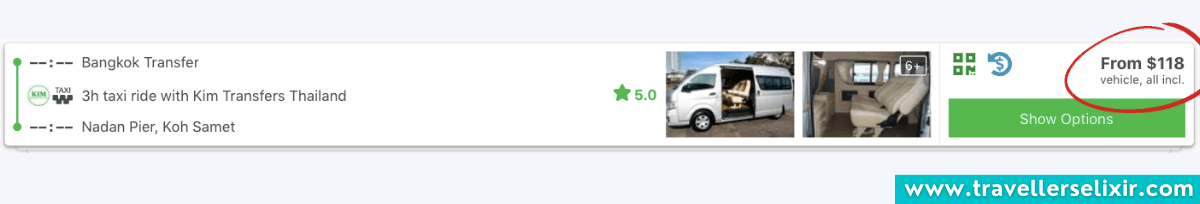
The image size is (1200, 204). I want to click on back of seat, so point(907,94).